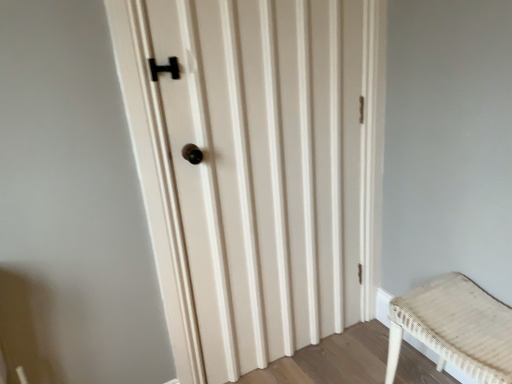
Question: Considering the positions of point (332, 268) and point (500, 362), is point (332, 268) closer or farther from the camera than point (500, 362)?

Choices:
 (A) closer
 (B) farther

Answer: (B)

Question: From the image's perspective, is matte wood door at center located above or below woven beige bench at lower right?

Choices:
 (A) below
 (B) above

Answer: (B)

Question: Considering the positions of matte wood door at center and woven beige bench at lower right in the image, is matte wood door at center taller or shorter than woven beige bench at lower right?

Choices:
 (A) short
 (B) tall

Answer: (B)

Question: From a real-world perspective, is woven beige bench at lower right physically located above or below matte wood door at center?

Choices:
 (A) below
 (B) above

Answer: (A)

Question: Choose the correct answer: Is woven beige bench at lower right inside matte wood door at center or outside it?

Choices:
 (A) outside
 (B) inside

Answer: (A)

Question: Based on their positions, is woven beige bench at lower right located to the left or right of matte wood door at center?

Choices:
 (A) left
 (B) right

Answer: (B)

Question: Is point (458, 284) closer or farther from the camera than point (225, 261)?

Choices:
 (A) closer
 (B) farther

Answer: (A)